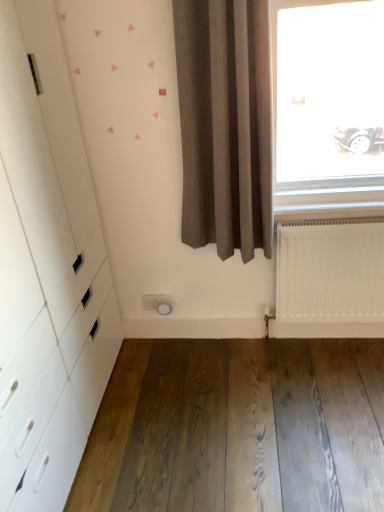
Where is `free spot below brown fabric curtain at center (from a real-world perspective)`? free spot below brown fabric curtain at center (from a real-world perspective) is located at coordinates click(x=225, y=347).